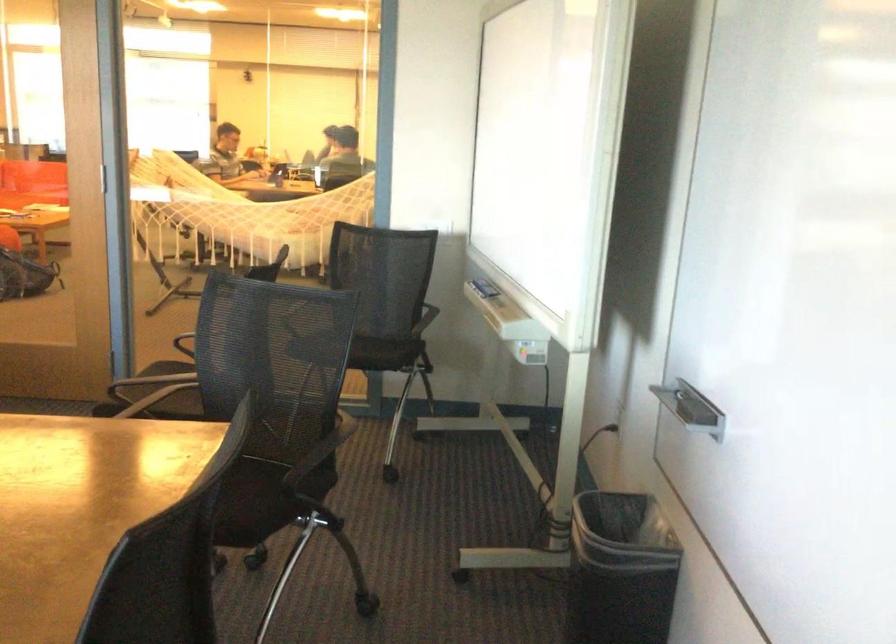
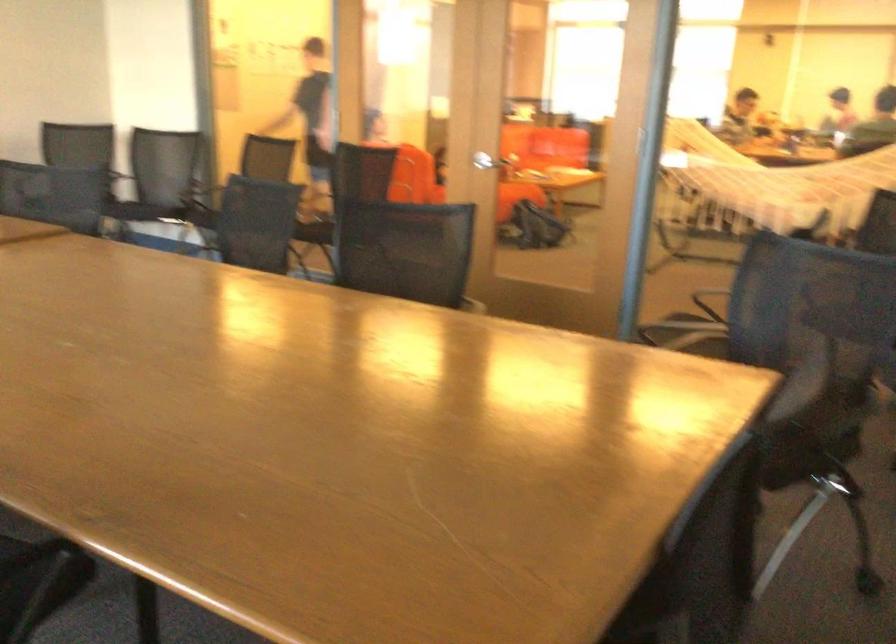
Question: I am providing you with two images of the same scene from different viewpoints. Which of the following objects are not visible in image2?

Choices:
 (A) silver door handle
 (B) chair sitting surface
 (C) sofa sitting surface
 (D) tape roll

Answer: (B)